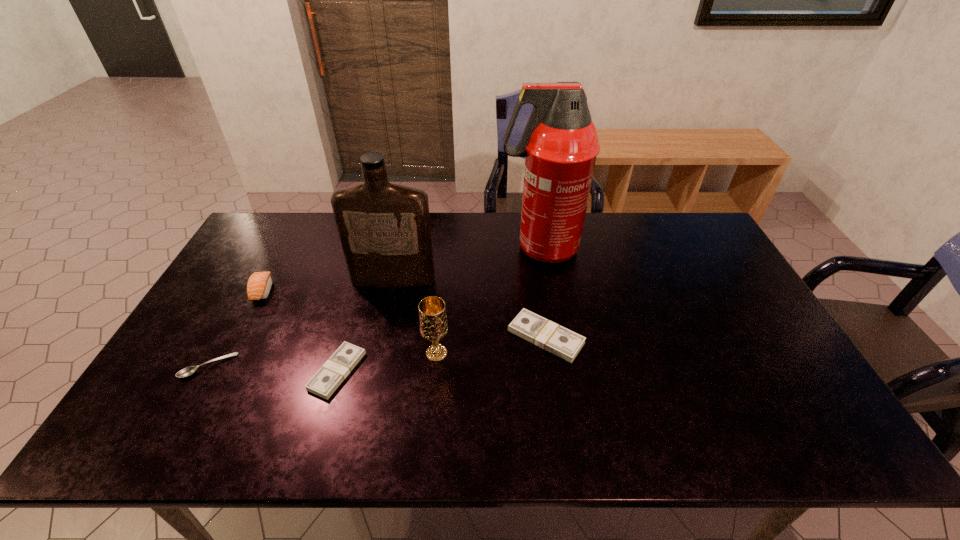
At what (x,y) coordinates should I click in order to perform the action: click on the shorter dollar. Please return your answer as a coordinate pair (x, y). Looking at the image, I should click on pyautogui.click(x=328, y=378).

Where is `the sixth tallest object`? The image size is (960, 540). the sixth tallest object is located at coordinates (328, 378).

At what (x,y) coordinates should I click in order to perform the action: click on the right dollar. Please return your answer as a coordinate pair (x, y). This screenshot has width=960, height=540. Looking at the image, I should click on (564, 343).

Where is `the taller dollar`? the taller dollar is located at coordinates (564, 343).

Find the location of a particular element. the tallest object is located at coordinates 560,144.

Locate an element on the screen. This screenshot has width=960, height=540. the farthest object is located at coordinates (560, 144).

Where is `sushi`? The height and width of the screenshot is (540, 960). sushi is located at coordinates (259, 285).

Find the location of a particular element. This screenshot has width=960, height=540. the shortest object is located at coordinates (187, 371).

I want to click on liquor, so click(384, 228).

Identify the location of the fifth shortest object. This screenshot has width=960, height=540. (433, 323).